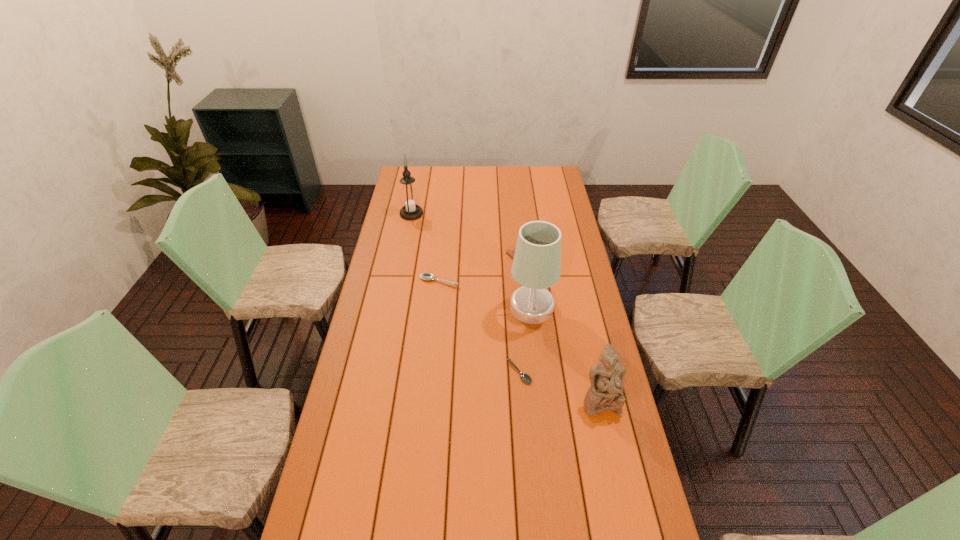
Locate an element on the screen. The height and width of the screenshot is (540, 960). vacant point located 0.190m on the right of the fifth object from right to left is located at coordinates (504, 281).

The height and width of the screenshot is (540, 960). I want to click on vacant region located 0.380m on the back of the right soupspoon, so click(513, 286).

Identify the location of free spot located on the front of the diary. (531, 312).

The width and height of the screenshot is (960, 540). I want to click on free space located 0.230m on the base of the lampshade, so click(x=451, y=308).

At what (x,y) coordinates should I click in order to perform the action: click on free space located on the base of the lampshade. Please return your answer as a coordinate pair (x, y). Looking at the image, I should click on (454, 308).

Where is `vacant space located 0.170m on the base of the lampshade`? The width and height of the screenshot is (960, 540). vacant space located 0.170m on the base of the lampshade is located at coordinates coord(467,308).

I want to click on vacant space located on the right of the oil lamp, so click(496, 214).

I want to click on free spot located on the front-facing side of the rightmost object, so click(629, 529).

What are the coordinates of `object located at the left edge` in the screenshot? It's located at (409, 198).

The width and height of the screenshot is (960, 540). I want to click on lampshade present at the right edge, so click(x=536, y=265).